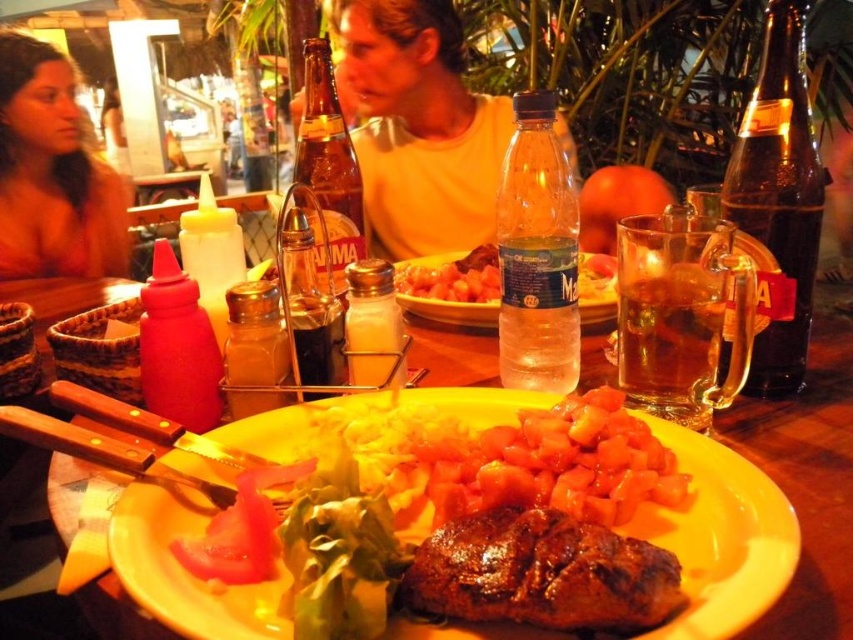
Between brown seared steak at center and translucent glass bottle at center, which one is positioned higher?

translucent glass bottle at center is above.

Can you confirm if brown seared steak at center is positioned above translucent glass bottle at center?

Actually, brown seared steak at center is below translucent glass bottle at center.

You are a GUI agent. You are given a task and a screenshot of the screen. Output one action in this format:
    pyautogui.click(x=<x>, y=<y>)
    Task: Click on the brown seared steak at center
    
    Given the screenshot: What is the action you would take?
    pyautogui.click(x=540, y=573)

Can you confirm if matte yellow plate at center is thinner than brown seared steak at center?

No, matte yellow plate at center is not thinner than brown seared steak at center.

Does matte yellow plate at center appear under brown seared steak at center?

No.

Identify the location of matte yellow plate at center. The width and height of the screenshot is (853, 640). (722, 538).

Is translucent glass salt shaker at center thinner than white glass salt shaker at center?

No.

Is translucent glass salt shaker at center bigger than white glass salt shaker at center?

No, translucent glass salt shaker at center is not bigger than white glass salt shaker at center.

Which is behind, point (277, 292) or point (370, 337)?

The point (370, 337) is more distant.

I want to click on translucent glass salt shaker at center, so click(x=254, y=349).